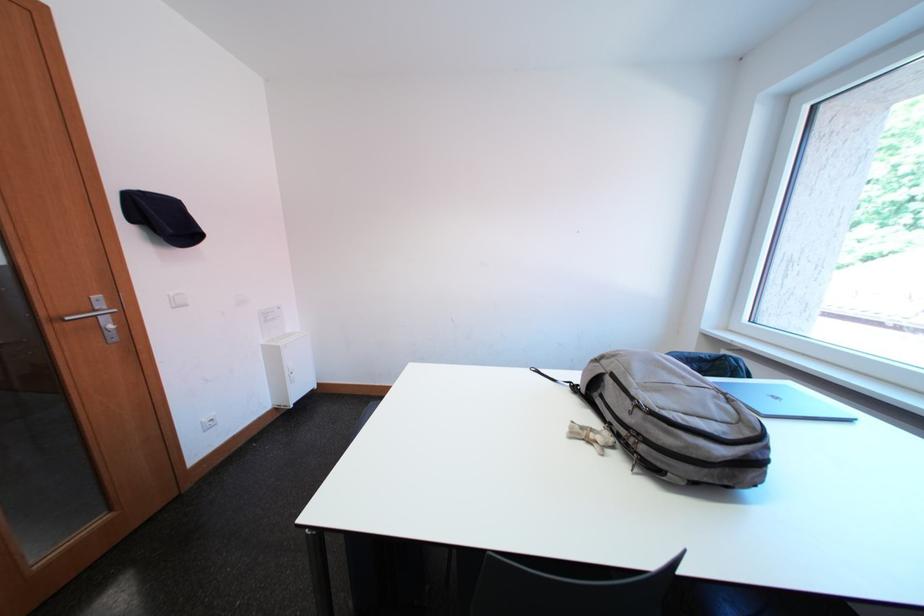
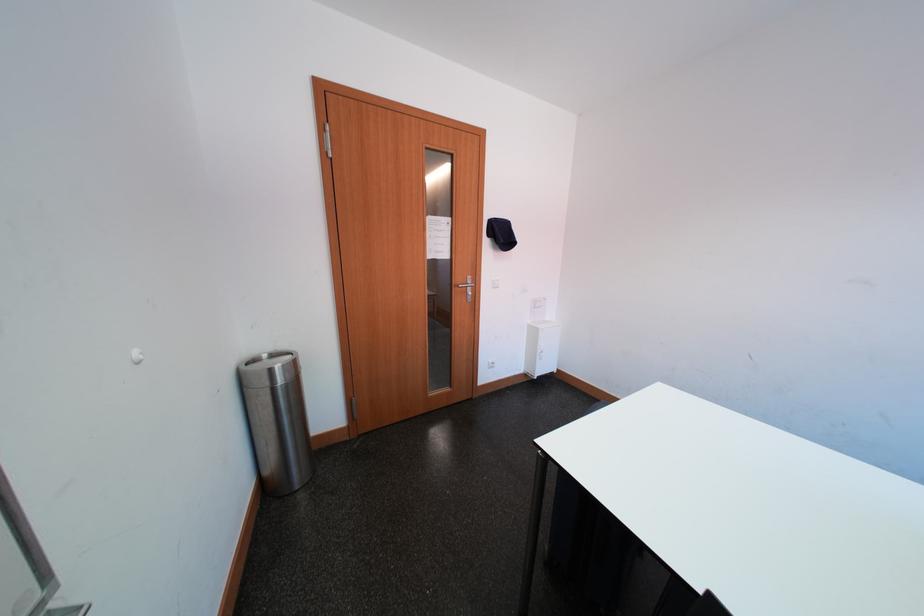
The point at [62,309] is marked in the first image. Where is the corresponding point in the second image?

(467, 283)